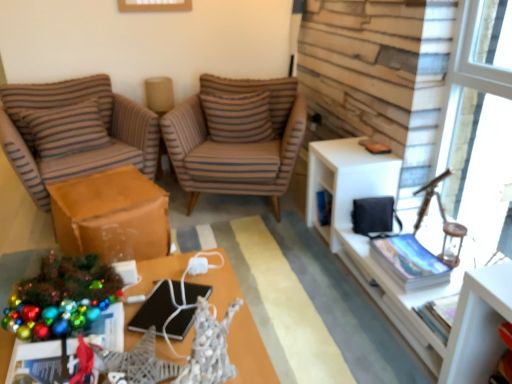
Identify the location of free point behind black matte laptop at center. The height and width of the screenshot is (384, 512). (181, 271).